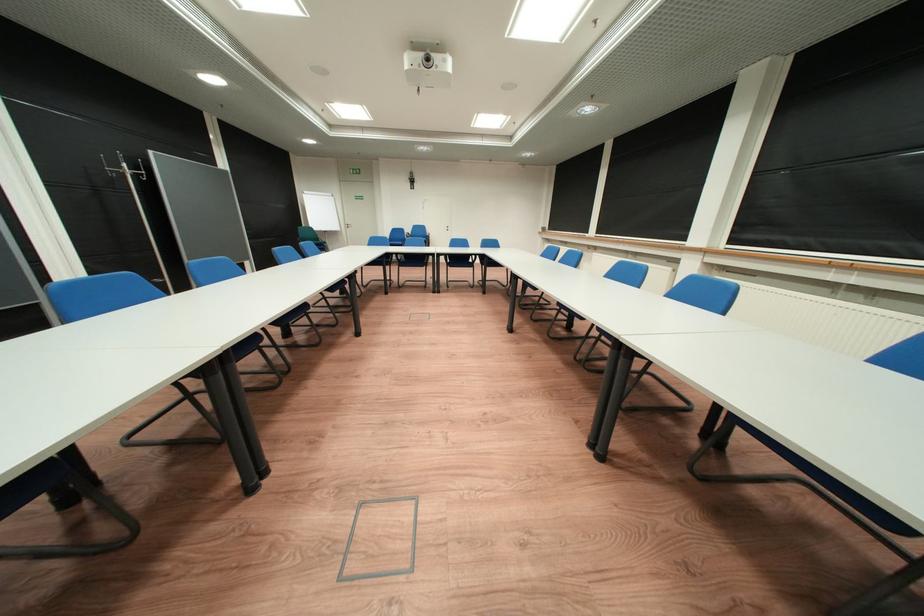
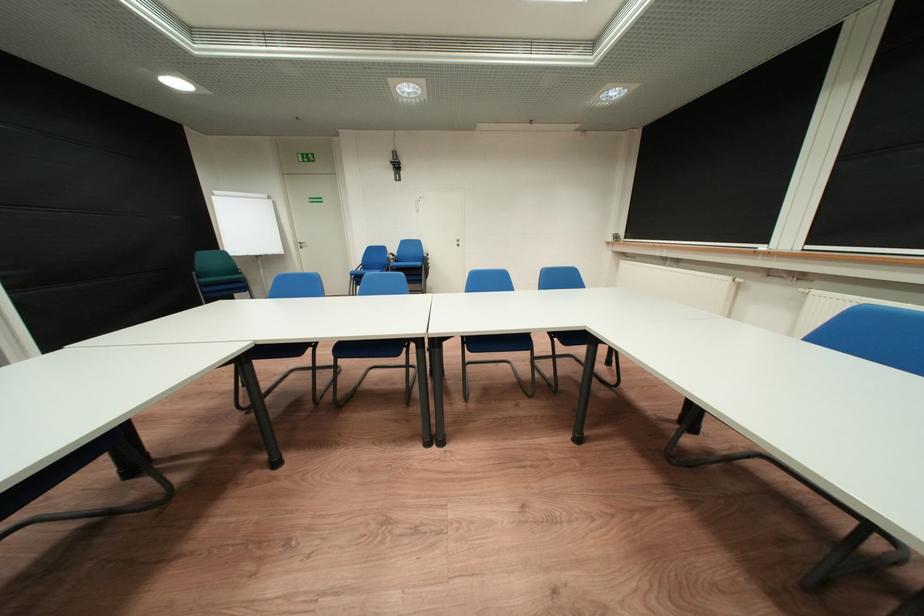
Question: The images are taken continuously from a first-person perspective. In which direction are you moving?

Choices:
 (A) Left
 (B) Right
 (C) Forward
 (D) Backward

Answer: (C)